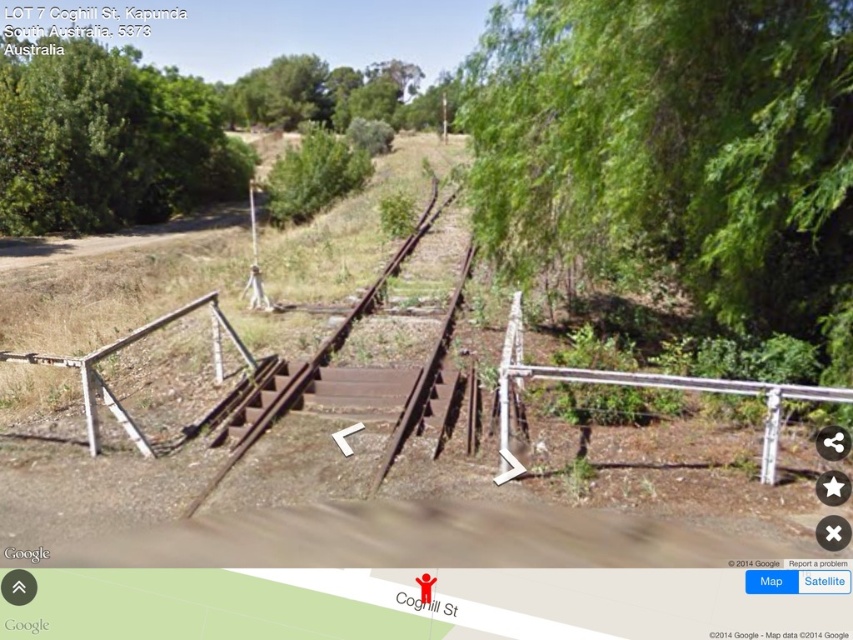
Consider the image. Can you confirm if rusty metal stairs at center is shorter than rusty metal rail at lower left?

Indeed, rusty metal stairs at center has a lesser height compared to rusty metal rail at lower left.

Measure the distance from rusty metal stairs at center to rusty metal rail at lower left.

4.43 feet

Which is in front, point (254, 420) or point (21, 355)?

Point (21, 355)

Where is `rusty metal stairs at center`? Image resolution: width=853 pixels, height=640 pixels. rusty metal stairs at center is located at coordinates (340, 396).

Who is more forward, (x=329, y=403) or (x=296, y=161)?

Point (x=329, y=403) is in front.

Can you confirm if rusty metal stairs at center is positioned to the left of green leafy tree at center?

Incorrect, rusty metal stairs at center is not on the left side of green leafy tree at center.

Is point (292, 400) closer to camera compared to point (279, 163)?

Yes, point (292, 400) is in front of point (279, 163).

I want to click on rusty metal stairs at center, so click(340, 396).

Which is in front, point (314, 157) or point (80, 372)?

Point (80, 372)

Who is higher up, green leafy tree at center or rusty metal rail at lower left?

green leafy tree at center is above.

The height and width of the screenshot is (640, 853). In order to click on green leafy tree at center in this screenshot , I will do `click(312, 176)`.